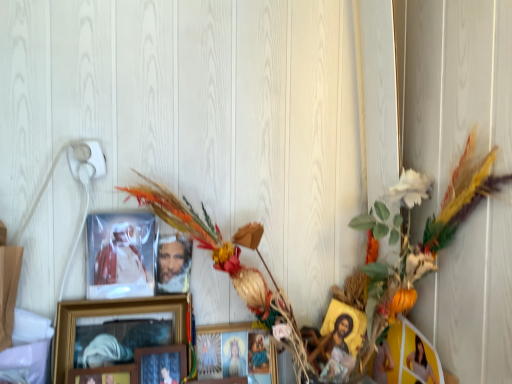
Where is `matte plastic figure at upper left`? The image size is (512, 384). matte plastic figure at upper left is located at coordinates (122, 256).

Find the location of a particular element. This screenshot has height=384, width=512. wooden picture frame at lower left, positioned as the first picture frame in left-to-right order is located at coordinates (104, 375).

The image size is (512, 384). What do you see at coordinates (104, 375) in the screenshot? I see `wooden picture frame at lower left, positioned as the first picture frame in left-to-right order` at bounding box center [104, 375].

Where is `matte wooden picture frame at center, which is the 3th picture frame from left to right`? matte wooden picture frame at center, which is the 3th picture frame from left to right is located at coordinates (161, 364).

You are a GUI agent. You are given a task and a screenshot of the screen. Output one action in this format:
    pyautogui.click(x=<x>, y=<y>)
    Task: Click on the matte plastic figure at upper left
    The image size is (512, 384).
    Given the screenshot: What is the action you would take?
    pyautogui.click(x=122, y=256)

Locate an element on the screen. The width and height of the screenshot is (512, 384). the 5th picture frame positioned below the matte plastic figure at upper left (from a real-world perspective) is located at coordinates (234, 352).

Is matte wooden picture frame at center, the fourth picture frame in the left-to-right sequence, taller than matte plastic figure at upper left?

Indeed, matte wooden picture frame at center, the fourth picture frame in the left-to-right sequence, has a greater height compared to matte plastic figure at upper left.

Looking at their sizes, would you say matte wooden picture frame at center, the fourth picture frame in the left-to-right sequence, is wider or thinner than matte plastic figure at upper left?

Considering their sizes, matte wooden picture frame at center, the fourth picture frame in the left-to-right sequence, looks broader than matte plastic figure at upper left.

Does matte wooden picture frame at center, the fourth picture frame in the left-to-right sequence, turn towards matte plastic figure at upper left?

No, matte wooden picture frame at center, the fourth picture frame in the left-to-right sequence, is not aimed at matte plastic figure at upper left.

Consider the image. Between matte plastic figure at upper left and matte wooden picture frame at center, which is the 2th picture frame from right to left, which one has smaller size?

matte plastic figure at upper left is smaller.

From the image's perspective, would you say matte plastic figure at upper left is shown under matte wooden picture frame at center, which is the 2th picture frame from right to left?

No, from the image's perspective, matte plastic figure at upper left is not beneath matte wooden picture frame at center, which is the 2th picture frame from right to left.

Which is more to the left, matte plastic figure at upper left or matte wooden picture frame at center, the fourth picture frame in the left-to-right sequence?

matte plastic figure at upper left.

Does matte wooden picture frame at center, the fourth picture frame in the left-to-right sequence, have a greater height compared to matte yellow photo frame at right, the first picture frame viewed from the right?

No, matte wooden picture frame at center, the fourth picture frame in the left-to-right sequence, is not taller than matte yellow photo frame at right, the first picture frame viewed from the right.

Is matte wooden picture frame at center, which is the 2th picture frame from right to left, far from matte yellow photo frame at right, marked as the fifth picture frame in a left-to-right arrangement?

No, there isn't a large distance between matte wooden picture frame at center, which is the 2th picture frame from right to left, and matte yellow photo frame at right, marked as the fifth picture frame in a left-to-right arrangement.

Does matte wooden picture frame at center, which is the 2th picture frame from right to left, come behind matte yellow photo frame at right, the first picture frame viewed from the right?

Yes.

Which object is thinner, matte wooden picture frame at center, the fourth picture frame in the left-to-right sequence, or matte yellow photo frame at right, marked as the fifth picture frame in a left-to-right arrangement?

With smaller width is matte yellow photo frame at right, marked as the fifth picture frame in a left-to-right arrangement.

Considering the positions of objects wooden picture frame at lower left, acting as the 5th picture frame starting from the right, and matte wooden picture frame at center, acting as the third picture frame starting from the right, in the image provided, who is behind, wooden picture frame at lower left, acting as the 5th picture frame starting from the right, or matte wooden picture frame at center, acting as the third picture frame starting from the right,?

matte wooden picture frame at center, acting as the third picture frame starting from the right, is further away from the camera.

Is wooden picture frame at lower left, acting as the 5th picture frame starting from the right, surrounding matte wooden picture frame at center, which is the 3th picture frame from left to right?

No, matte wooden picture frame at center, which is the 3th picture frame from left to right, is located outside of wooden picture frame at lower left, acting as the 5th picture frame starting from the right.

Considering the sizes of wooden picture frame at lower left, acting as the 5th picture frame starting from the right, and matte wooden picture frame at center, which is the 3th picture frame from left to right, in the image, is wooden picture frame at lower left, acting as the 5th picture frame starting from the right, taller or shorter than matte wooden picture frame at center, which is the 3th picture frame from left to right,?

Clearly, wooden picture frame at lower left, acting as the 5th picture frame starting from the right, is shorter compared to matte wooden picture frame at center, which is the 3th picture frame from left to right.

Which point is more forward, (x=112, y=380) or (x=156, y=347)?

The point (x=112, y=380) is more forward.

From the image's perspective, which is above, matte yellow photo frame at right, marked as the fifth picture frame in a left-to-right arrangement, or matte plastic figure at upper left?

matte plastic figure at upper left appears higher in the image.

Does matte yellow photo frame at right, the first picture frame viewed from the right, have a greater height compared to matte plastic figure at upper left?

Yes.

Considering the relative sizes of matte yellow photo frame at right, marked as the fifth picture frame in a left-to-right arrangement, and matte plastic figure at upper left in the image provided, is matte yellow photo frame at right, marked as the fifth picture frame in a left-to-right arrangement, smaller than matte plastic figure at upper left?

No, matte yellow photo frame at right, marked as the fifth picture frame in a left-to-right arrangement, is not smaller than matte plastic figure at upper left.

This screenshot has width=512, height=384. In the image, there is a matte yellow photo frame at right, the first picture frame viewed from the right. Find the location of `person above it (from the image's perspective)`. person above it (from the image's perspective) is located at coordinates (122, 256).

Which is in front, matte plastic figure at upper left or wooden framed picture at center, which is counted as the fourth picture frame, starting from the right?

wooden framed picture at center, which is counted as the fourth picture frame, starting from the right, is closer to the camera.

Is matte plastic figure at upper left oriented away from wooden framed picture at center, which is counted as the fourth picture frame, starting from the right?

matte plastic figure at upper left is not turned away from wooden framed picture at center, which is counted as the fourth picture frame, starting from the right.

Which is nearer, (141, 267) or (79, 307)?

Point (141, 267) is farther from the camera than point (79, 307).

From a real-world perspective, is matte plastic figure at upper left below wooden framed picture at center, which is counted as the fourth picture frame, starting from the right?

No, from a real-world perspective, matte plastic figure at upper left is not beneath wooden framed picture at center, which is counted as the fourth picture frame, starting from the right.

Is matte wooden picture frame at center, acting as the third picture frame starting from the right, far from wooden picture frame at lower left, positioned as the first picture frame in left-to-right order?

No, matte wooden picture frame at center, acting as the third picture frame starting from the right, is not far from wooden picture frame at lower left, positioned as the first picture frame in left-to-right order.

Looking at this image, from the image's perspective, is matte wooden picture frame at center, which is the 3th picture frame from left to right, located beneath wooden picture frame at lower left, acting as the 5th picture frame starting from the right?

Actually, matte wooden picture frame at center, which is the 3th picture frame from left to right, appears above wooden picture frame at lower left, acting as the 5th picture frame starting from the right, in the image.

Between matte wooden picture frame at center, acting as the third picture frame starting from the right, and wooden picture frame at lower left, positioned as the first picture frame in left-to-right order, which one has smaller size?

wooden picture frame at lower left, positioned as the first picture frame in left-to-right order.

Can you tell me how much matte wooden picture frame at center, acting as the third picture frame starting from the right, and wooden picture frame at lower left, acting as the 5th picture frame starting from the right, differ in facing direction?

The angular difference between matte wooden picture frame at center, acting as the third picture frame starting from the right, and wooden picture frame at lower left, acting as the 5th picture frame starting from the right, is 0.0001 degrees.

There is a matte plastic figure at upper left. Where is `the 5th picture frame below it (from a real-world perspective)`? the 5th picture frame below it (from a real-world perspective) is located at coordinates (234, 352).

Identify the location of the 5th picture frame below when counting from the matte plastic figure at upper left (from the image's perspective). (234, 352).

When comparing their distances from matte wooden picture frame at center, which is the 3th picture frame from left to right, does matte wooden picture frame at center, the fourth picture frame in the left-to-right sequence, or wooden picture frame at lower left, positioned as the first picture frame in left-to-right order, seem further?

Based on the image, matte wooden picture frame at center, the fourth picture frame in the left-to-right sequence, appears to be further to matte wooden picture frame at center, which is the 3th picture frame from left to right.

When comparing their distances from matte plastic figure at upper left, does matte yellow photo frame at right, marked as the fifth picture frame in a left-to-right arrangement, or matte wooden picture frame at center, the fourth picture frame in the left-to-right sequence, seem further?

The object further to matte plastic figure at upper left is matte yellow photo frame at right, marked as the fifth picture frame in a left-to-right arrangement.

Estimate the real-world distances between objects in this image. Which object is closer to matte wooden picture frame at center, acting as the third picture frame starting from the right, matte yellow photo frame at right, marked as the fifth picture frame in a left-to-right arrangement, or wooden picture frame at lower left, positioned as the first picture frame in left-to-right order?

wooden picture frame at lower left, positioned as the first picture frame in left-to-right order.

Which object lies further to the anchor point matte yellow photo frame at right, the first picture frame viewed from the right, wooden picture frame at lower left, positioned as the first picture frame in left-to-right order, or matte plastic figure at upper left?

Among the two, matte plastic figure at upper left is located further to matte yellow photo frame at right, the first picture frame viewed from the right.

Based on their spatial positions, is matte yellow photo frame at right, the first picture frame viewed from the right, or matte wooden picture frame at center, the fourth picture frame in the left-to-right sequence, closer to wooden framed picture at center, the second picture frame viewed from the left?

matte wooden picture frame at center, the fourth picture frame in the left-to-right sequence, lies closer to wooden framed picture at center, the second picture frame viewed from the left, than the other object.

Looking at the image, which one is located closer to matte wooden picture frame at center, acting as the third picture frame starting from the right, wooden picture frame at lower left, acting as the 5th picture frame starting from the right, or matte plastic figure at upper left?

wooden picture frame at lower left, acting as the 5th picture frame starting from the right, is positioned closer to the anchor matte wooden picture frame at center, acting as the third picture frame starting from the right.

From the image, which object appears to be farther from matte wooden picture frame at center, which is the 2th picture frame from right to left, wooden framed picture at center, the second picture frame viewed from the left, or wooden picture frame at lower left, positioned as the first picture frame in left-to-right order?

wooden picture frame at lower left, positioned as the first picture frame in left-to-right order, is further to matte wooden picture frame at center, which is the 2th picture frame from right to left.

Estimate the real-world distances between objects in this image. Which object is further from wooden framed picture at center, the second picture frame viewed from the left, wooden picture frame at lower left, acting as the 5th picture frame starting from the right, or matte wooden picture frame at center, acting as the third picture frame starting from the right?

Among the two, matte wooden picture frame at center, acting as the third picture frame starting from the right, is located further to wooden framed picture at center, the second picture frame viewed from the left.

You are a GUI agent. You are given a task and a screenshot of the screen. Output one action in this format:
    pyautogui.click(x=<x>, y=<y>)
    Task: Click on the picture frame situated between matte wooden picture frame at center, acting as the third picture frame starting from the right, and matte yellow photo frame at right, marked as the fifth picture frame in a left-to-right arrangement, from left to right
    This screenshot has height=384, width=512.
    Given the screenshot: What is the action you would take?
    pyautogui.click(x=234, y=352)

Where is `picture frame between wooden picture frame at lower left, positioned as the first picture frame in left-to-right order, and matte wooden picture frame at center, acting as the third picture frame starting from the right, in the horizontal direction`? Image resolution: width=512 pixels, height=384 pixels. picture frame between wooden picture frame at lower left, positioned as the first picture frame in left-to-right order, and matte wooden picture frame at center, acting as the third picture frame starting from the right, in the horizontal direction is located at coordinates (106, 316).

The image size is (512, 384). I want to click on person between wooden picture frame at lower left, positioned as the first picture frame in left-to-right order, and matte yellow photo frame at right, marked as the fifth picture frame in a left-to-right arrangement, from left to right, so click(x=122, y=256).

Identify the location of picture frame between matte plastic figure at upper left and matte wooden picture frame at center, acting as the third picture frame starting from the right, in the vertical direction. The width and height of the screenshot is (512, 384). (106, 316).